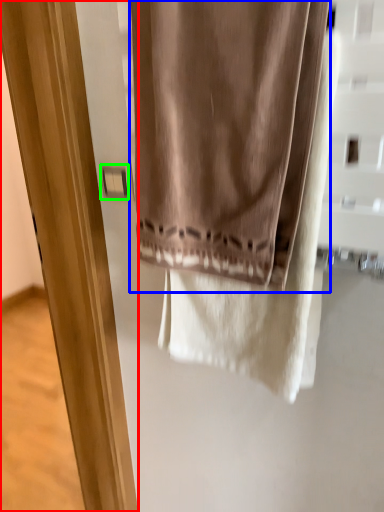
Question: Estimate the real-world distances between objects in this image. Which object is closer to screen door (highlighted by a red box), curtain (highlighted by a blue box) or light switch (highlighted by a green box)?

Choices:
 (A) curtain
 (B) light switch

Answer: (B)